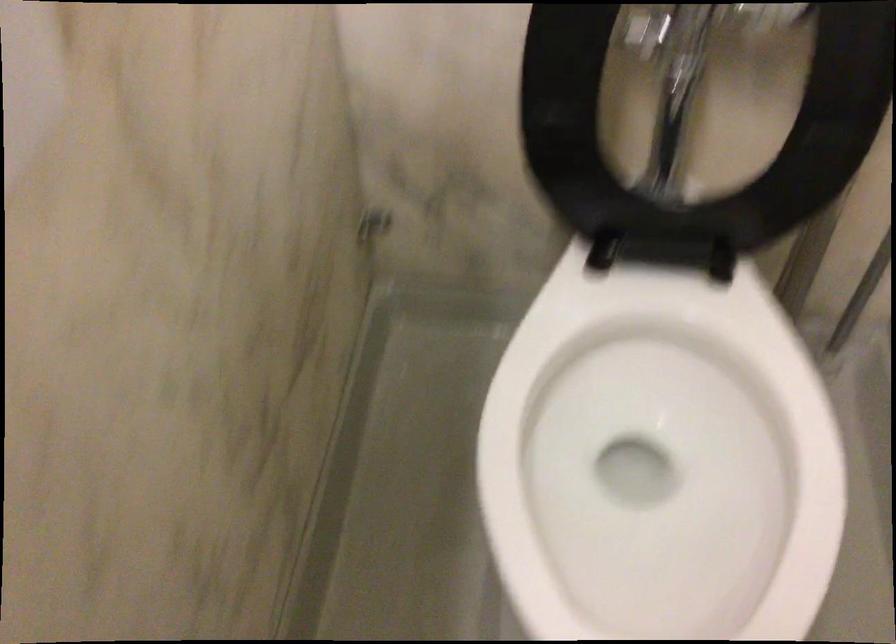
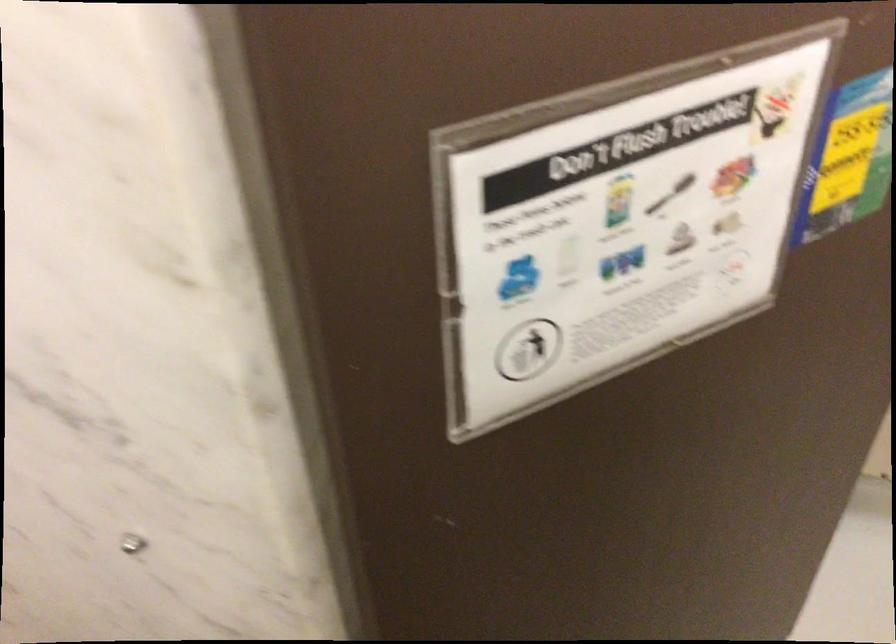
The first image is from the beginning of the video and the second image is from the end. How did the camera likely rotate when shooting the video?

The camera rotated toward right-down.